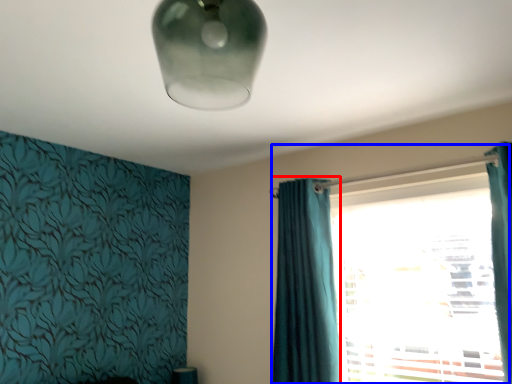
Question: Which object is closer to the camera taking this photo, curtain (highlighted by a red box) or window (highlighted by a blue box)?

Choices:
 (A) curtain
 (B) window

Answer: (B)